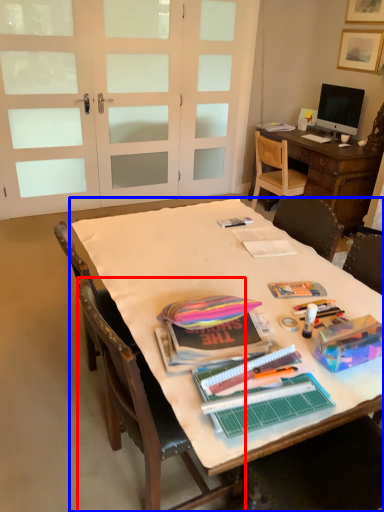
Question: Which of the following is the farthest to the observer, chair (highlighted by a red box) or table (highlighted by a blue box)?

Choices:
 (A) chair
 (B) table

Answer: (A)